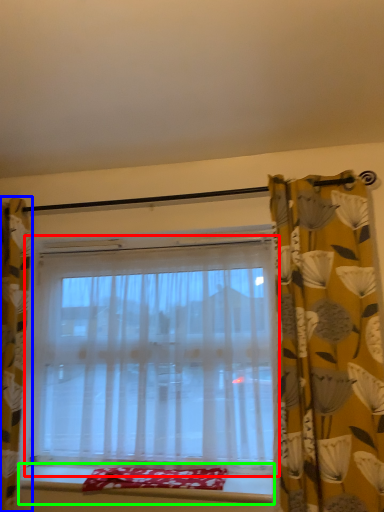
Question: Which is nearer to the window (highlighted by a red box)? curtain (highlighted by a blue box) or window sill (highlighted by a green box).

Choices:
 (A) curtain
 (B) window sill

Answer: (B)